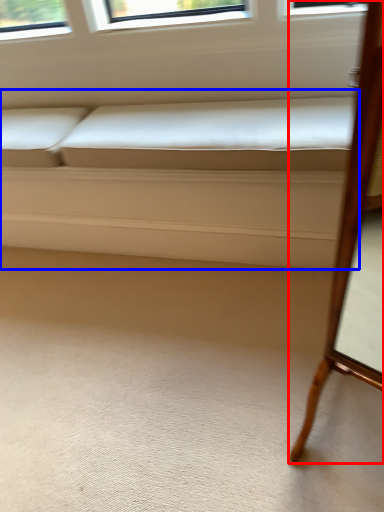
Question: Which of the following is the farthest to the observer, furniture (highlighted by a red box) or couch (highlighted by a blue box)?

Choices:
 (A) furniture
 (B) couch

Answer: (B)